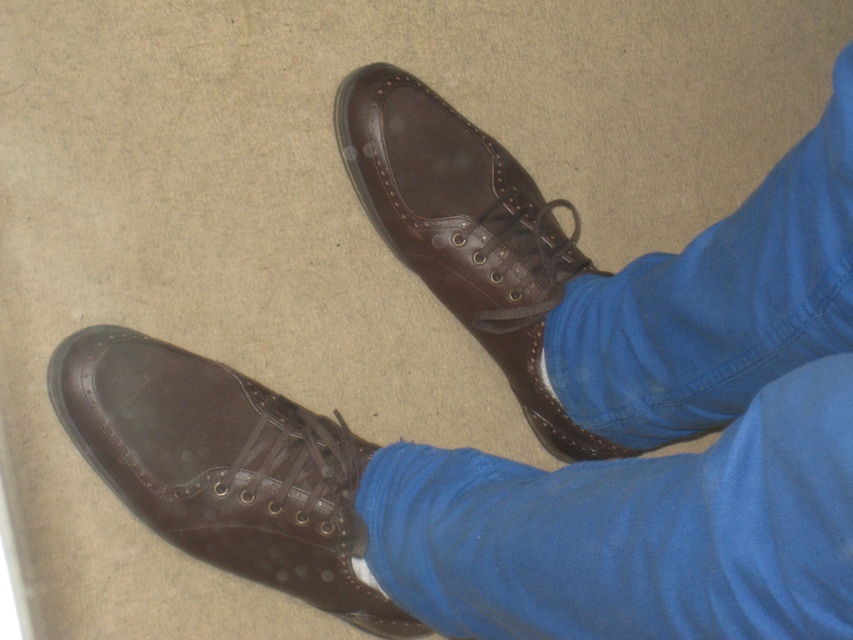
Is shiny brown shoe at lower left above shiny brown leather shoe at center?

Actually, shiny brown shoe at lower left is below shiny brown leather shoe at center.

Based on the photo, is shiny brown shoe at lower left to the left of shiny brown leather shoe at center from the viewer's perspective?

Yes, shiny brown shoe at lower left is to the left of shiny brown leather shoe at center.

At what (x,y) coordinates should I click in order to perform the action: click on shiny brown shoe at lower left. Please return your answer as a coordinate pair (x, y). Image resolution: width=853 pixels, height=640 pixels. Looking at the image, I should click on (223, 467).